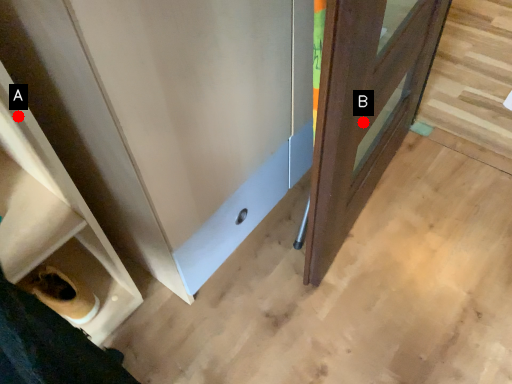
Question: Two points are circled on the image, labeled by A and B beside each circle. Among these points, which one is farthest from the camera?

Choices:
 (A) A is further
 (B) B is further

Answer: (B)